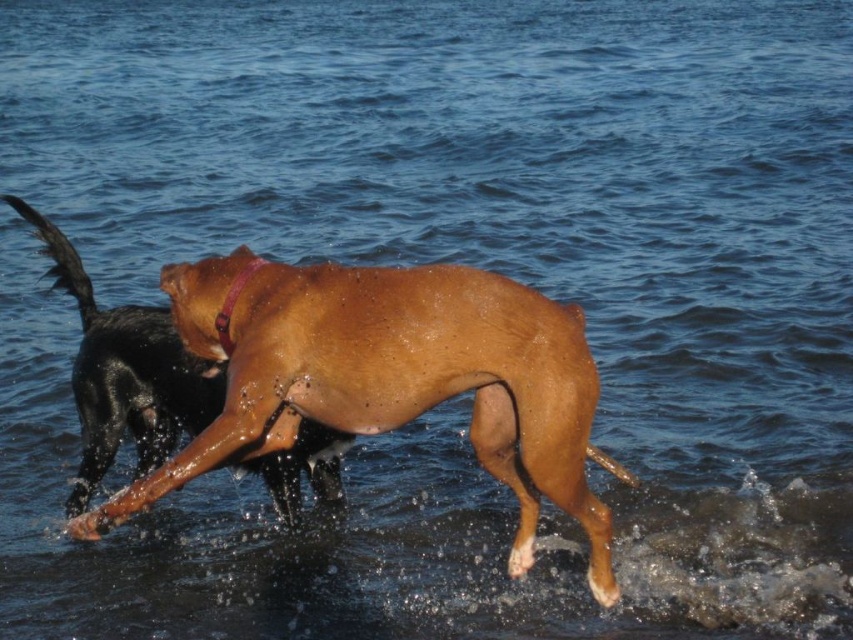
You are a photographer trying to capture the sandy brown fur at center and the brown leather neckband at center in a clear shot. Which object is positioned higher in the frame?

The sandy brown fur at center is much taller than the brown leather neckband at center, so it is positioned higher in the frame.

You are a photographer trying to capture the sandy brown fur at center in the image. Based on its 2D coordinates, which part of the image frame would you focus on?

The sandy brown fur at center is located at point (392, 378), which is slightly to the right and lower than the exact center of the image frame.